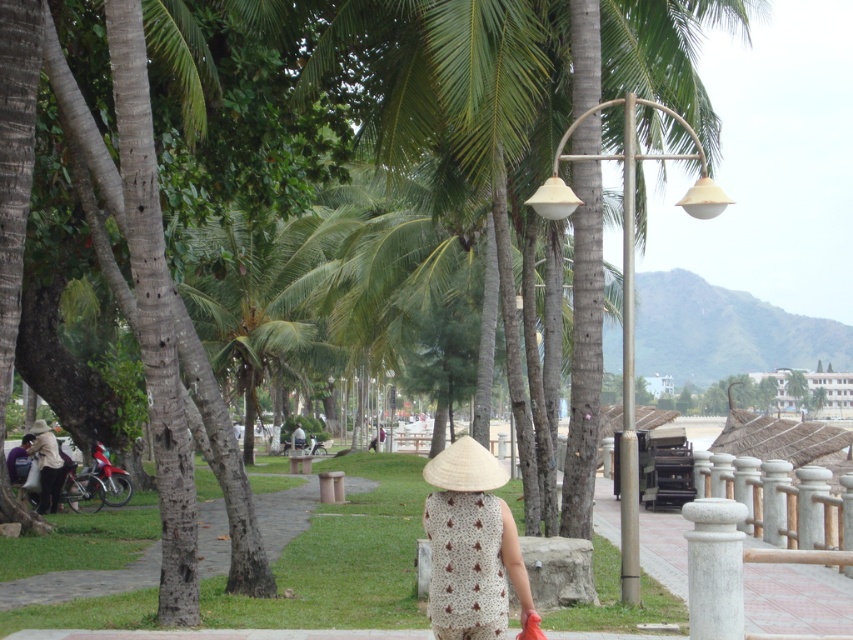
Question: Does green grass at lower center have a smaller size compared to white straw hat at center?

Choices:
 (A) no
 (B) yes

Answer: (A)

Question: Which point is farther from the camera taking this photo?

Choices:
 (A) (53, 452)
 (B) (463, 538)
 (C) (111, 589)
 (D) (489, 472)

Answer: (A)

Question: Does white woven hat at center appear over light brown woven hat at lower left?

Choices:
 (A) yes
 (B) no

Answer: (A)

Question: Estimate the real-world distances between objects in this image. Which object is closer to the green grass at lower center?

Choices:
 (A) white woven hat at center
 (B) white straw hat at center

Answer: (B)

Question: Can you confirm if green grass at lower center is positioned above light brown woven hat at lower left?

Choices:
 (A) yes
 (B) no

Answer: (B)

Question: Estimate the real-world distances between objects in this image. Which object is closer to the green grass at lower center?

Choices:
 (A) white woven hat at center
 (B) light brown woven hat at lower left

Answer: (B)